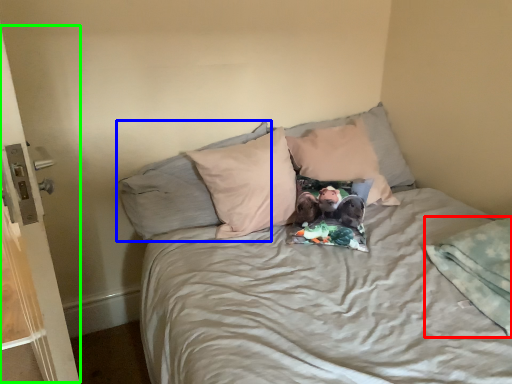
Question: Which object is the closest to the blanket (highlighted by a red box)? Choose among these: pillow (highlighted by a blue box) or screen door (highlighted by a green box).

Choices:
 (A) pillow
 (B) screen door

Answer: (A)